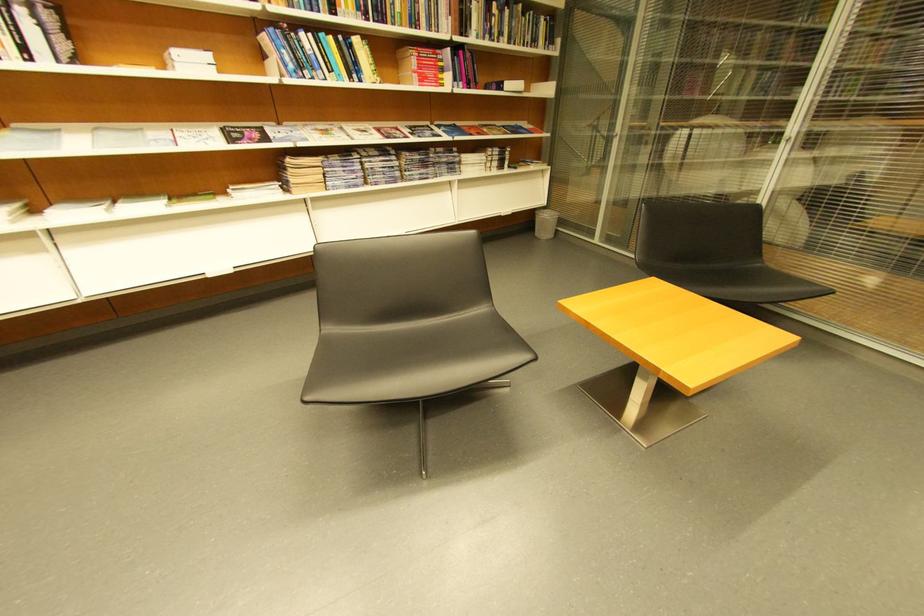
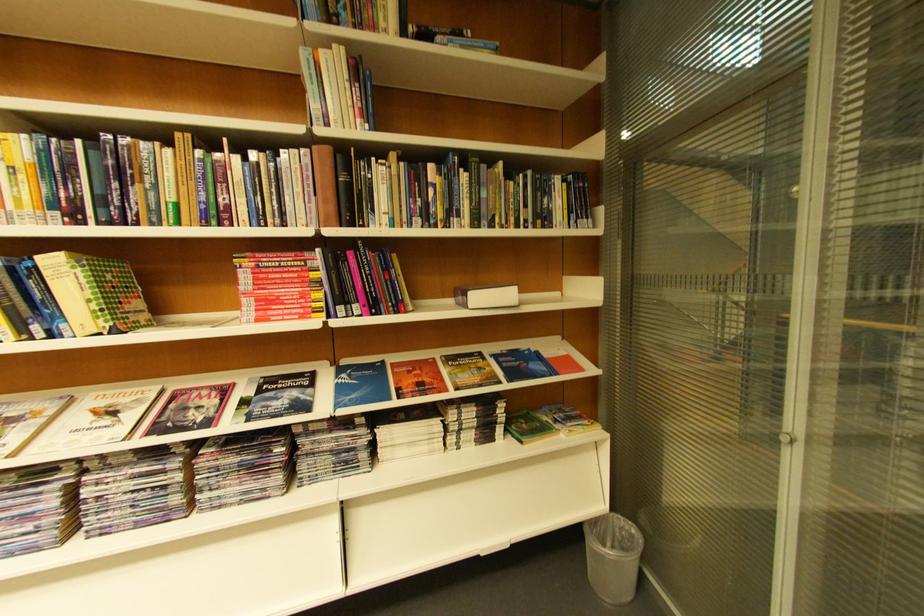
In the second image, find the point that corresponds to point 367,43 in the first image.

(63, 264)